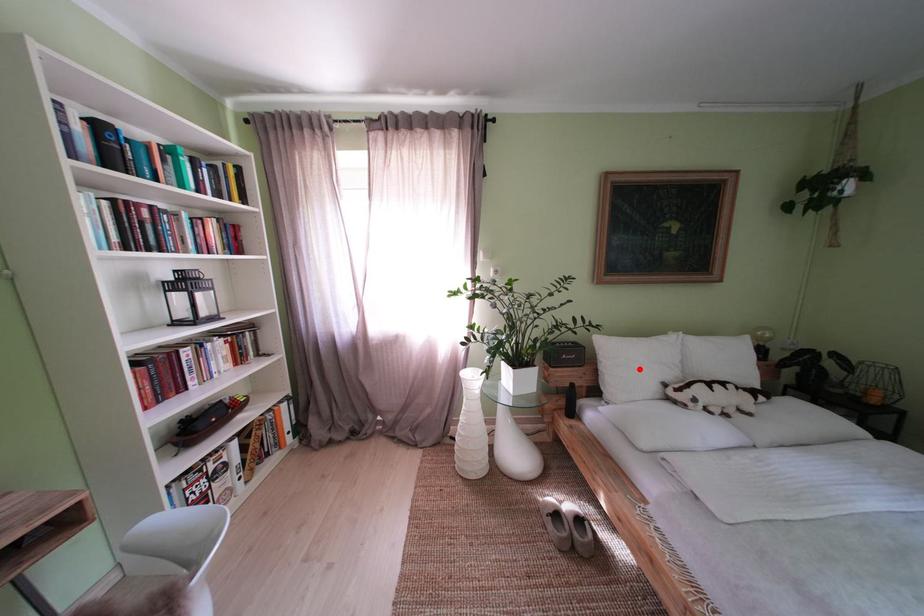
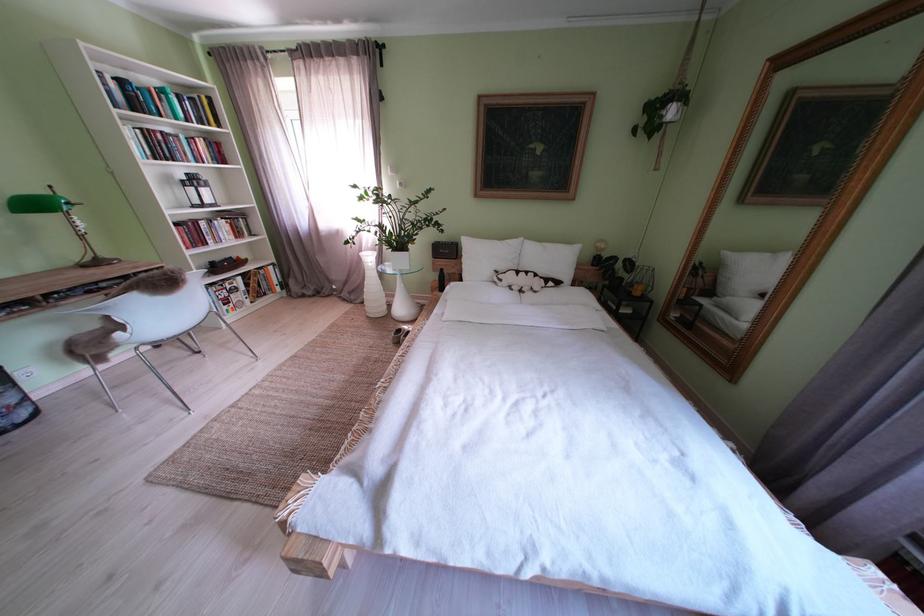
Find the pixel in the second image that matches the highlighted location in the first image.

(490, 262)